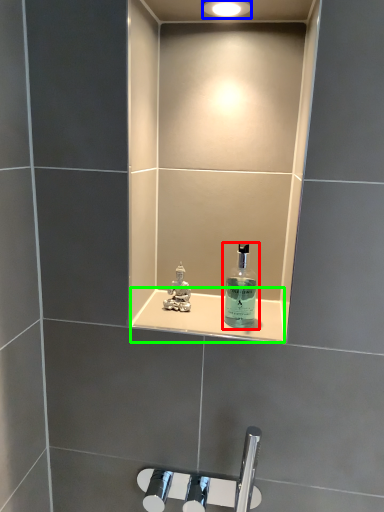
Question: Which is nearer to the bottle (highlighted by a red box)? light fixture (highlighted by a blue box) or ledge (highlighted by a green box).

Choices:
 (A) light fixture
 (B) ledge

Answer: (B)